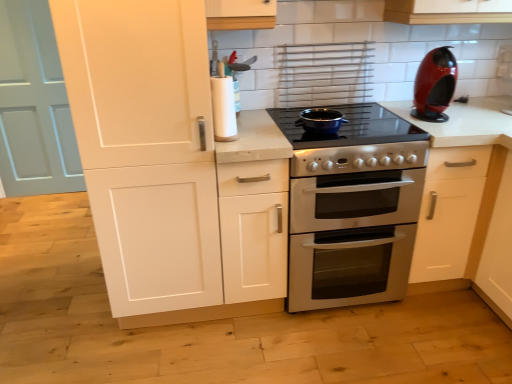
Where is `free space underneath matte black pot at center (from a real-world perspective)`? free space underneath matte black pot at center (from a real-world perspective) is located at coordinates (324, 122).